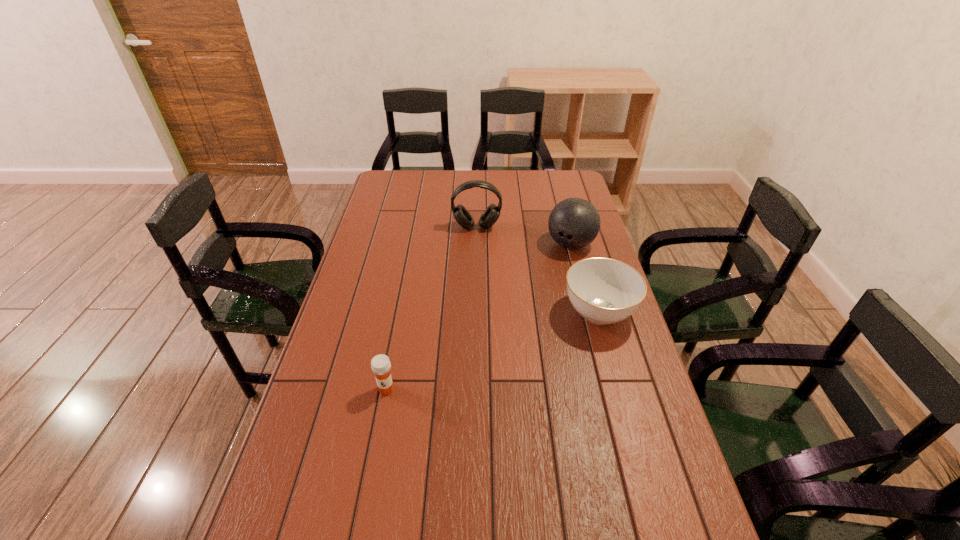
Where is `object that stands as the second closest to the headset`? object that stands as the second closest to the headset is located at coordinates (604, 291).